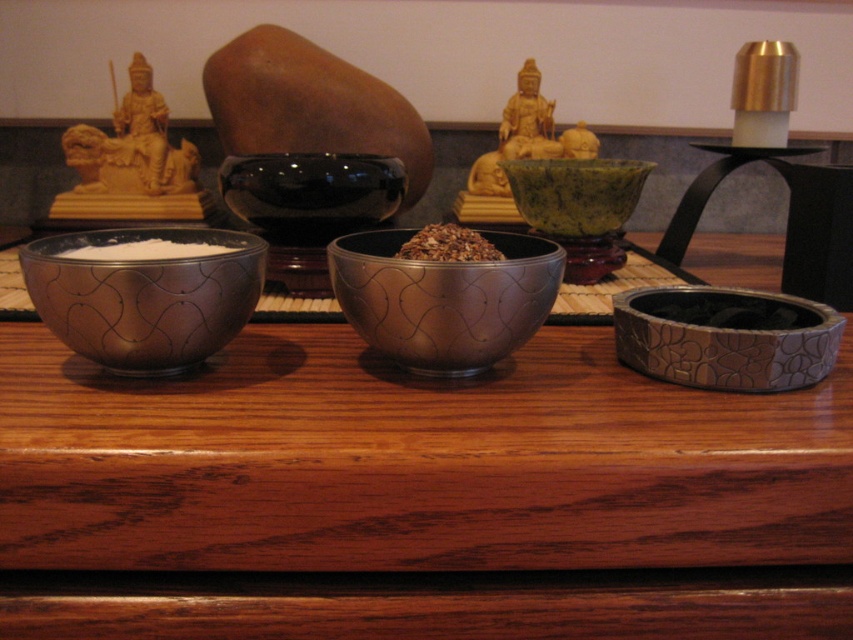
You are organizing a display and need to place the golden statue at upper center and the brown textured rice at center. Given their sizes, which object should you place first to ensure stability?

The golden statue at upper center should be placed first because it is larger than the brown textured rice at center, allowing for a stable base before adding smaller items.

You are arranging items on a table and want to place a small vase between the golden statue at upper center and the brown textured rice at center. Based on their heights, which item should the vase be placed closer to?

The golden statue at upper center is taller than the brown textured rice at center, so the vase should be placed closer to the brown textured rice at center to maintain balance.

You are organizing a science experiment and need to choose a container for a chemical solution. You have the green marble bowl at center and the white powder at left. Which container can hold a taller liquid volume without spilling?

The green marble bowl at center is taller than the white powder at left, so it can hold a taller liquid volume without spilling.